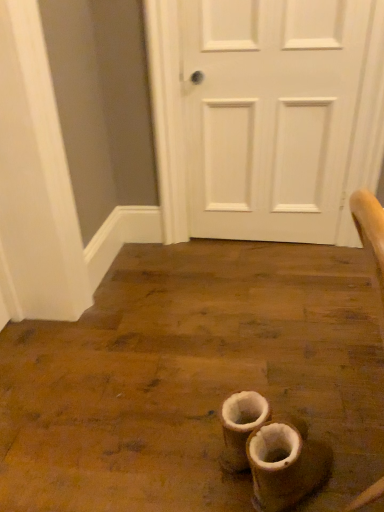
The height and width of the screenshot is (512, 384). I want to click on white matte door at center, so click(x=269, y=114).

Describe the element at coordinates (269, 114) in the screenshot. I see `white matte door at center` at that location.

At what (x,y) coordinates should I click in order to perform the action: click on white matte door at center. Please return your answer as a coordinate pair (x, y). The height and width of the screenshot is (512, 384). Looking at the image, I should click on (269, 114).